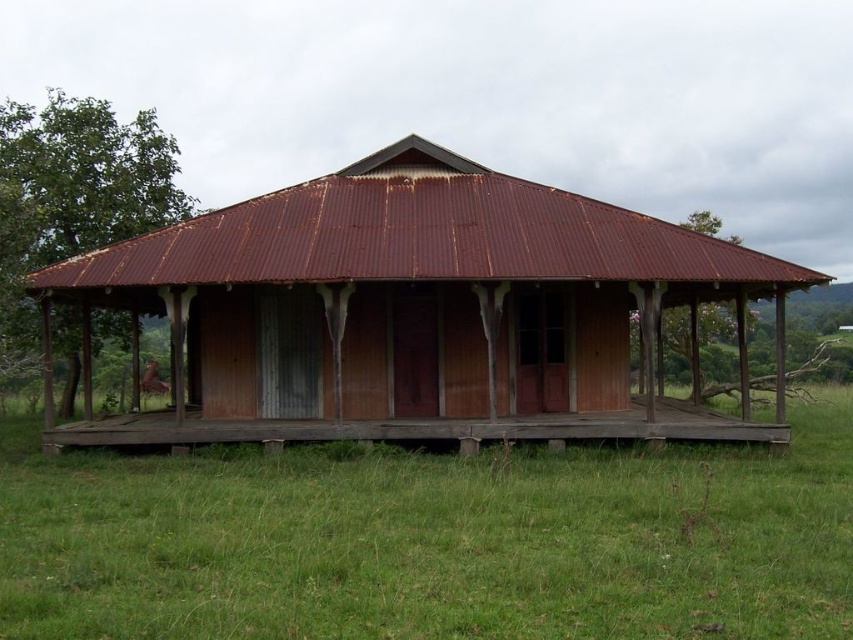
You are standing in front of the rustic wooden house and want to place a small potted plant on the structure that is higher up. Which object should you choose between the rusty wood hut at center and the rusty wood porch at center?

The rusty wood hut at center is located above the rusty wood porch at center, so you should place the potted plant on the rusty wood hut at center since it is higher up.

You are standing in front of the rustic wooden house with a red corrugated metal roof. You see two points marked on the house facade at coordinates point (393, 408) and point (296, 428). Which point is closer to you?

Point (296, 428) is closer to you because it is less further to the camera than point (393, 408).

You are standing at the center of the field and see the point marked at coordinates (415, 312). What is located there?

The point at coordinates (415, 312) is where the rusty wood hut at center is located.